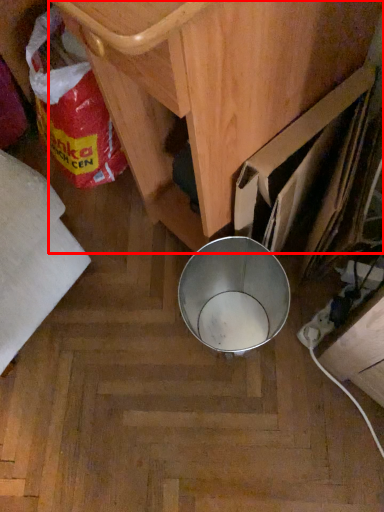
Question: From the image's perspective, considering the relative positions of furniture (annotated by the red box) and waste in the image provided, where is furniture (annotated by the red box) located with respect to the staircase?

Choices:
 (A) below
 (B) above

Answer: (B)